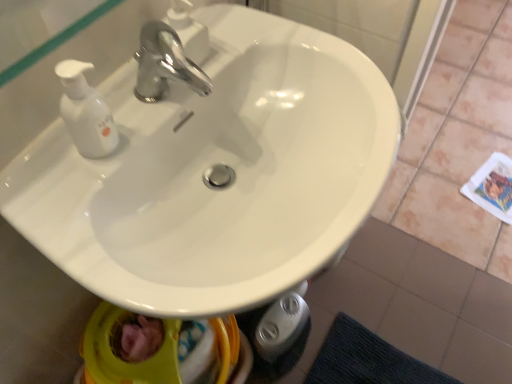
What do you see at coordinates (165, 64) in the screenshot? Image resolution: width=512 pixels, height=384 pixels. I see `chrome metallic faucet at upper center` at bounding box center [165, 64].

Locate an element on the screen. chrome metallic faucet at upper center is located at coordinates (165, 64).

In order to face white glossy sink at center, should I rotate leftwards or rightwards?

Turn left by 1.813 degrees to look at white glossy sink at center.

Identify the location of white glossy sink at center. (212, 164).

The image size is (512, 384). What do you see at coordinates (212, 164) in the screenshot? I see `white glossy sink at center` at bounding box center [212, 164].

What are the coordinates of `chrome metallic faucet at upper center` in the screenshot? It's located at (165, 64).

Can you confirm if white glossy sink at center is positioned to the left of chrome metallic faucet at upper center?

Incorrect, white glossy sink at center is not on the left side of chrome metallic faucet at upper center.

Considering their positions, is white glossy sink at center located in front of or behind chrome metallic faucet at upper center?

white glossy sink at center is in front of chrome metallic faucet at upper center.

Considering the points (227, 32) and (195, 76), which point is in front, point (227, 32) or point (195, 76)?

The point (195, 76) is more forward.

From the image's perspective, is white glossy sink at center on chrome metallic faucet at upper center?

No, from the image's perspective, white glossy sink at center is not over chrome metallic faucet at upper center.

From a real-world perspective, between white glossy sink at center and chrome metallic faucet at upper center, who is vertically higher?

In real-world perspective, chrome metallic faucet at upper center is above.

Which of these two, white glossy sink at center or chrome metallic faucet at upper center, is thinner?

With smaller width is chrome metallic faucet at upper center.

Does white glossy sink at center have a lesser height compared to chrome metallic faucet at upper center?

No.

Considering the sizes of white glossy sink at center and chrome metallic faucet at upper center in the image, is white glossy sink at center bigger or smaller than chrome metallic faucet at upper center?

Clearly, white glossy sink at center is larger in size than chrome metallic faucet at upper center.

Can we say white glossy sink at center lies outside chrome metallic faucet at upper center?

white glossy sink at center is positioned outside chrome metallic faucet at upper center.

Is white glossy sink at center beside chrome metallic faucet at upper center?

No, white glossy sink at center is not in contact with chrome metallic faucet at upper center.

Could you tell me if white glossy sink at center is facing chrome metallic faucet at upper center?

No, white glossy sink at center is not turned towards chrome metallic faucet at upper center.

Locate an element on the screen. The width and height of the screenshot is (512, 384). tap above the white glossy sink at center (from a real-world perspective) is located at coordinates (165, 64).

Which object is positioned more to the left, chrome metallic faucet at upper center or white glossy sink at center?

chrome metallic faucet at upper center.

Does chrome metallic faucet at upper center lie in front of white glossy sink at center?

No.

Considering the positions of point (161, 44) and point (85, 196), is point (161, 44) closer or farther from the camera than point (85, 196)?

Point (161, 44) is positioned farther from the camera compared to point (85, 196).

From the image's perspective, which one is positioned higher, chrome metallic faucet at upper center or white glossy sink at center?

chrome metallic faucet at upper center.

From a real-world perspective, between chrome metallic faucet at upper center and white glossy sink at center, who is vertically higher?

chrome metallic faucet at upper center, from a real-world perspective.

Looking at their sizes, would you say chrome metallic faucet at upper center is wider or thinner than white glossy sink at center?

Considering their sizes, chrome metallic faucet at upper center looks slimmer than white glossy sink at center.

Between chrome metallic faucet at upper center and white glossy sink at center, which one has more height?

white glossy sink at center is taller.

Considering the sizes of objects chrome metallic faucet at upper center and white glossy sink at center in the image provided, who is bigger, chrome metallic faucet at upper center or white glossy sink at center?

With larger size is white glossy sink at center.

Looking at this image, which is correct: chrome metallic faucet at upper center is inside white glossy sink at center, or outside of it?

chrome metallic faucet at upper center exists outside the volume of white glossy sink at center.

Would you say chrome metallic faucet at upper center is a long distance from white glossy sink at center?

chrome metallic faucet at upper center is actually quite close to white glossy sink at center.

Is chrome metallic faucet at upper center oriented away from white glossy sink at center?

That's not correct — chrome metallic faucet at upper center is not looking away from white glossy sink at center.

Identify the location of tap behind the white glossy sink at center. (165, 64).

Image resolution: width=512 pixels, height=384 pixels. In order to click on sink on the right of chrome metallic faucet at upper center in this screenshot , I will do `click(212, 164)`.

Where is `sink that is under the chrome metallic faucet at upper center (from a real-world perspective)`? This screenshot has width=512, height=384. sink that is under the chrome metallic faucet at upper center (from a real-world perspective) is located at coordinates (212, 164).